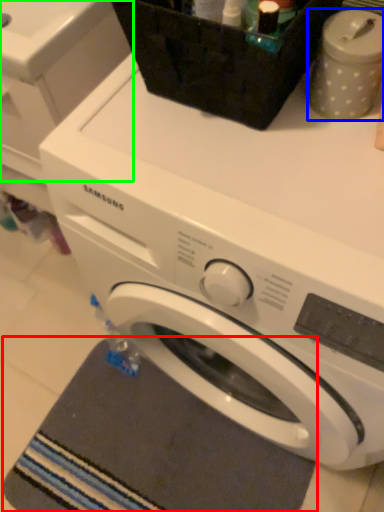
Question: Which object is positioned closest to bath mat (highlighted by a red box)? Select from appliance (highlighted by a blue box) and washing machine (highlighted by a green box).

Choices:
 (A) appliance
 (B) washing machine

Answer: (B)